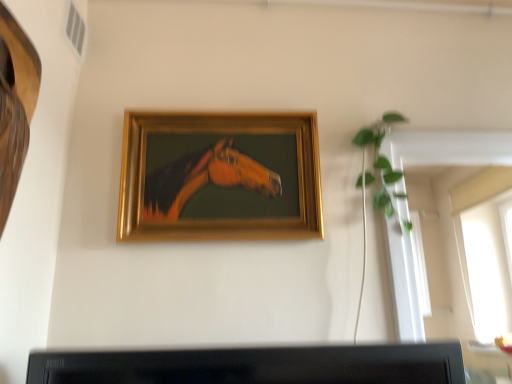
Question: Considering the relative sizes of gold wooden picture frame at center and green leafy plant at upper right in the image provided, is gold wooden picture frame at center wider than green leafy plant at upper right?

Choices:
 (A) no
 (B) yes

Answer: (B)

Question: Is there a large distance between gold wooden picture frame at center and green leafy plant at upper right?

Choices:
 (A) yes
 (B) no

Answer: (B)

Question: Is gold wooden picture frame at center turned away from green leafy plant at upper right?

Choices:
 (A) yes
 (B) no

Answer: (B)

Question: Does gold wooden picture frame at center have a smaller size compared to green leafy plant at upper right?

Choices:
 (A) no
 (B) yes

Answer: (A)

Question: Does gold wooden picture frame at center have a greater height compared to green leafy plant at upper right?

Choices:
 (A) no
 (B) yes

Answer: (B)

Question: Can you confirm if gold wooden picture frame at center is shorter than green leafy plant at upper right?

Choices:
 (A) no
 (B) yes

Answer: (A)

Question: Is green leafy plant at upper right at the left side of gold wooden picture frame at center?

Choices:
 (A) yes
 (B) no

Answer: (B)

Question: Considering the relative sizes of green leafy plant at upper right and gold wooden picture frame at center in the image provided, is green leafy plant at upper right thinner than gold wooden picture frame at center?

Choices:
 (A) no
 (B) yes

Answer: (B)

Question: From the image's perspective, is green leafy plant at upper right over gold wooden picture frame at center?

Choices:
 (A) no
 (B) yes

Answer: (B)

Question: Is gold wooden picture frame at center completely or partially inside green leafy plant at upper right?

Choices:
 (A) no
 (B) yes

Answer: (A)

Question: From a real-world perspective, is green leafy plant at upper right on gold wooden picture frame at center?

Choices:
 (A) yes
 (B) no

Answer: (A)

Question: From a real-world perspective, is green leafy plant at upper right under gold wooden picture frame at center?

Choices:
 (A) no
 (B) yes

Answer: (A)

Question: From the image's perspective, relative to green leafy plant at upper right, is gold wooden picture frame at center above or below?

Choices:
 (A) above
 (B) below

Answer: (B)